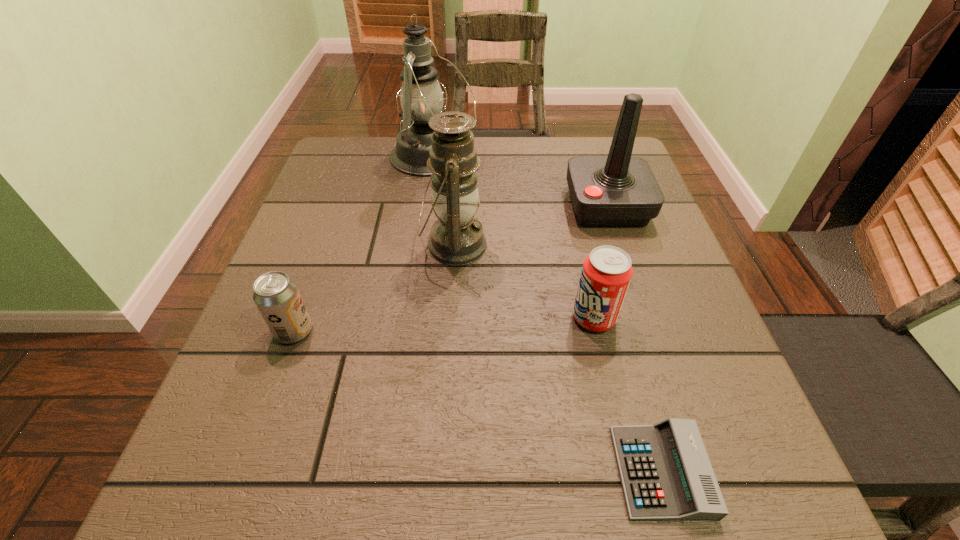
Select which object appears as the fifth closest to the farther oil lamp. Please provide its 2D coordinates. Your answer should be formatted as a tuple, i.e. [(x, y)], where the tuple contains the x and y coordinates of a point satisfying the conditions above.

[(666, 474)]

Locate an element on the screen. vacant space that satisfies the following two spatial constraints: 1. on the back side of the nearer oil lamp; 2. on the left side of the fifth tallest object is located at coordinates (325, 246).

At what (x,y) coordinates should I click in order to perform the action: click on vacant position in the image that satisfies the following two spatial constraints: 1. on the front side of the nearer oil lamp; 2. on the left side of the shortest object. Please return your answer as a coordinate pair (x, y). Image resolution: width=960 pixels, height=540 pixels. Looking at the image, I should click on (441, 471).

The image size is (960, 540). What are the coordinates of `free location that satisfies the following two spatial constraints: 1. on the surface of the fourth tallest object; 2. on the right side of the calculator` in the screenshot? It's located at (629, 471).

Identify the location of blank space that satisfies the following two spatial constraints: 1. on the surface of the soda can; 2. on the right side of the calculator. This screenshot has height=540, width=960. (629, 471).

You are a GUI agent. You are given a task and a screenshot of the screen. Output one action in this format:
    pyautogui.click(x=<x>, y=<y>)
    Task: Click on the vacant space that satisfies the following two spatial constraints: 1. on the surface of the soda can; 2. on the front side of the second shortest object
    
    Given the screenshot: What is the action you would take?
    pyautogui.click(x=597, y=331)